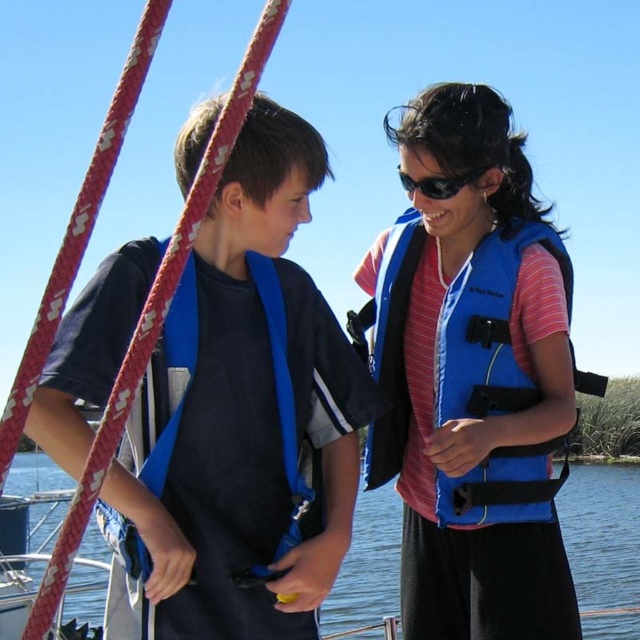
Which is behind, point (481, 518) or point (88, 573)?

The point (88, 573) is behind.

Who is lower down, blue fabric life jacket at center or blue water at center?

Positioned lower is blue water at center.

Does point (470, 296) come behind point (628, 636)?

No.

Find the location of a particular element. This screenshot has height=640, width=640. blue fabric life jacket at center is located at coordinates (483, 320).

Based on the photo, can you confirm if blue fabric life vest at left is thinner than blue fabric life jacket at left?

Incorrect, blue fabric life vest at left's width is not less than blue fabric life jacket at left's.

Between blue fabric life vest at left and blue fabric life jacket at left, which one is positioned lower?

Positioned lower is blue fabric life jacket at left.

Image resolution: width=640 pixels, height=640 pixels. In order to click on blue fabric life vest at left in this screenshot , I will do `click(252, 410)`.

Between blue fabric life vest at left and blue fabric life jacket at center, which one is positioned higher?

Positioned higher is blue fabric life jacket at center.

Find the location of a particular element. The height and width of the screenshot is (640, 640). blue fabric life vest at left is located at coordinates (252, 410).